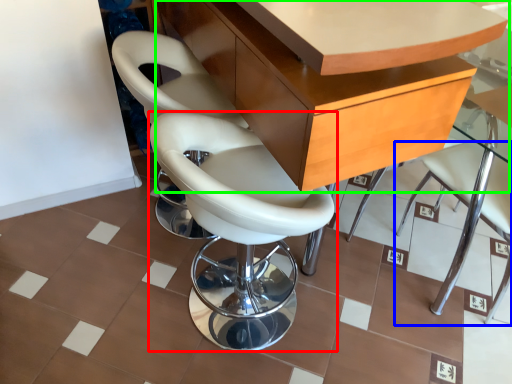
Question: Considering the real-world distances, which object is closest to chair (highlighted by a red box)? chair (highlighted by a blue box) or table (highlighted by a green box).

Choices:
 (A) chair
 (B) table

Answer: (B)